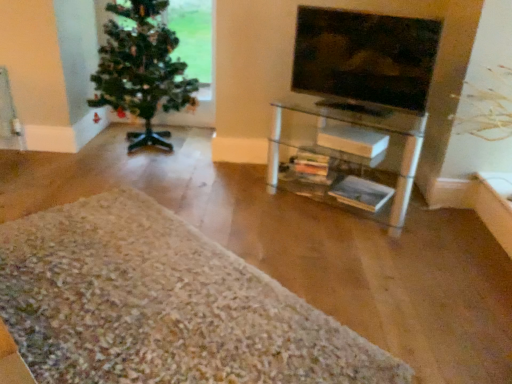
Find the location of `free space in front of clear glass shelf at center`. free space in front of clear glass shelf at center is located at coordinates (378, 267).